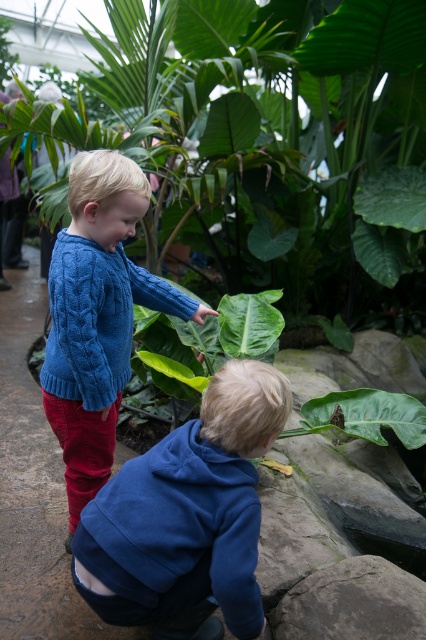
Which of these two, green leafy plant at center or cable-knit sweater at center, stands taller?

green leafy plant at center

Between point (359, 161) and point (51, 352), which one is positioned behind?

Positioned behind is point (359, 161).

Locate an element on the screen. The width and height of the screenshot is (426, 640). green leafy plant at center is located at coordinates click(273, 141).

The image size is (426, 640). What do you see at coordinates (187, 516) in the screenshot?
I see `blue fleece jacket at lower center` at bounding box center [187, 516].

What do you see at coordinates (187, 516) in the screenshot?
I see `blue fleece jacket at lower center` at bounding box center [187, 516].

This screenshot has height=640, width=426. I want to click on blue fleece jacket at lower center, so click(187, 516).

Does cable-knit sweater at center have a greater width compared to gray rough rock at lower center?

Yes, cable-knit sweater at center is wider than gray rough rock at lower center.

Is point (132, 275) more distant than point (382, 636)?

Yes, it is.

Locate an element on the screen. cable-knit sweater at center is located at coordinates (97, 317).